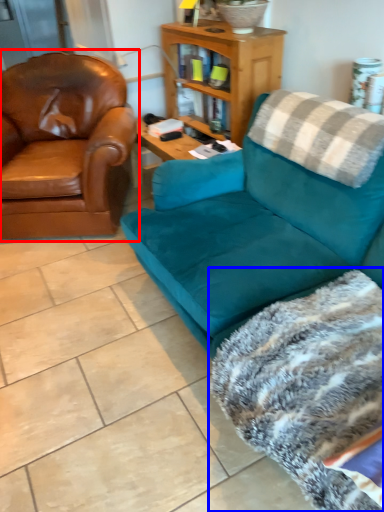
Question: Which object appears closest to the camera in this image, chair (highlighted by a red box) or blanket (highlighted by a blue box)?

Choices:
 (A) chair
 (B) blanket

Answer: (B)